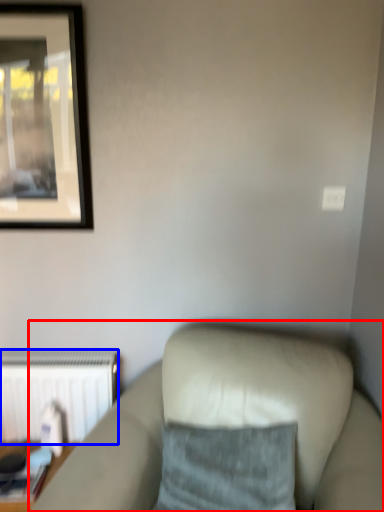
Question: Which object is further to the camera taking this photo, studio couch (highlighted by a red box) or radiator (highlighted by a blue box)?

Choices:
 (A) studio couch
 (B) radiator

Answer: (B)